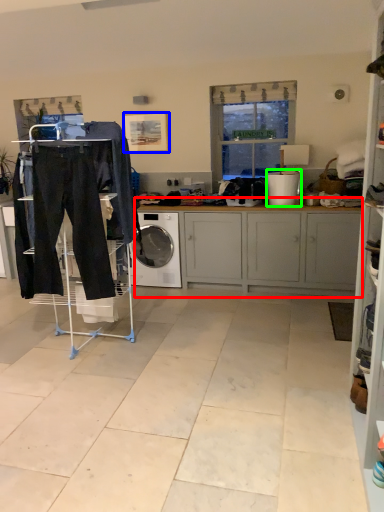
Question: Which object is the closest to the cabinetry (highlighted by a red box)? Choose among these: picture frame (highlighted by a blue box) or appliance (highlighted by a green box).

Choices:
 (A) picture frame
 (B) appliance

Answer: (B)